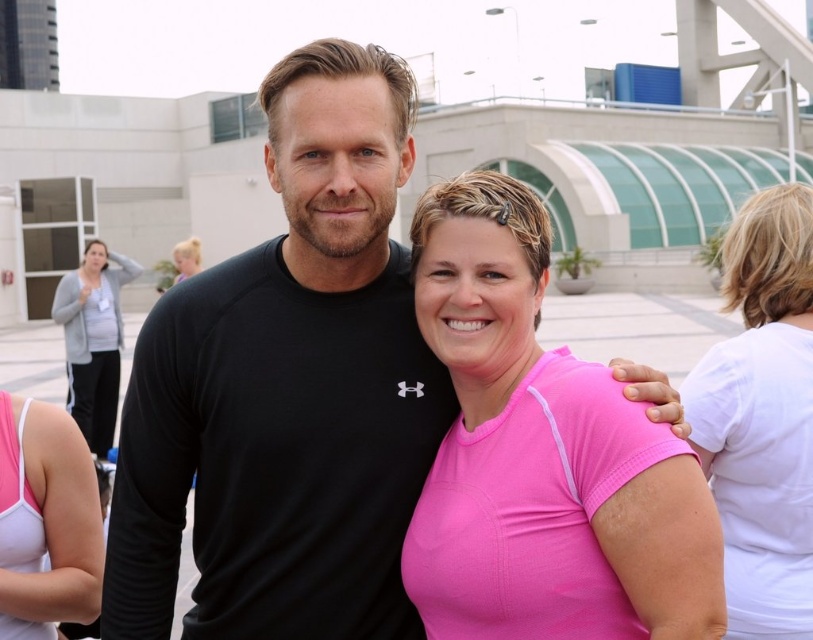
Question: Does black matte t-shirt at center appear on the right side of white matte t-shirt at right?

Choices:
 (A) yes
 (B) no

Answer: (B)

Question: Which of the following is the closest to the observer?

Choices:
 (A) (759, 214)
 (B) (20, 481)
 (C) (372, 573)
 (D) (90, 394)

Answer: (B)

Question: Does pink fabric sports bra at lower left appear on the left side of gray fleece jacket at left?

Choices:
 (A) yes
 (B) no

Answer: (B)

Question: Where is white matte t-shirt at right located in relation to gray fleece jacket at left in the image?

Choices:
 (A) below
 (B) above

Answer: (A)

Question: Which of the following is the closest to the observer?

Choices:
 (A) (41, 435)
 (B) (181, 268)
 (C) (807, 200)

Answer: (A)

Question: Which object appears farthest from the camera in this image?

Choices:
 (A) pink matte shirt at center
 (B) pink fabric shirt at upper center
 (C) black matte t-shirt at center

Answer: (B)